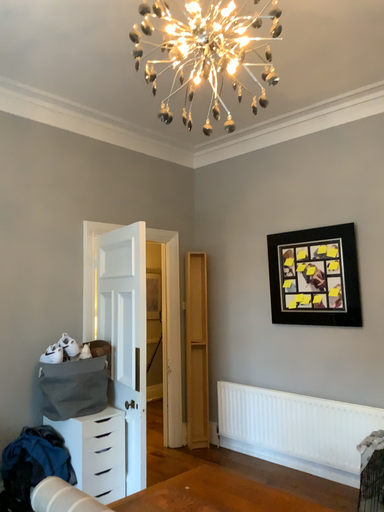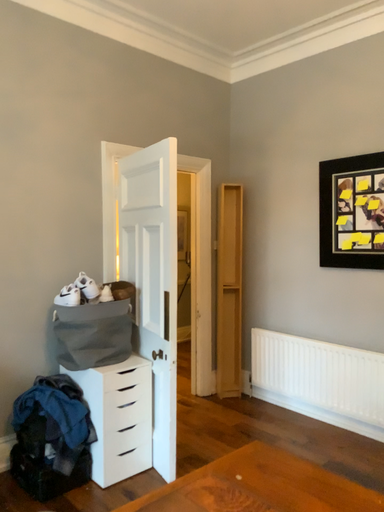
Question: Which way did the camera rotate in the video?

Choices:
 (A) rotated downward
 (B) rotated upward

Answer: (A)